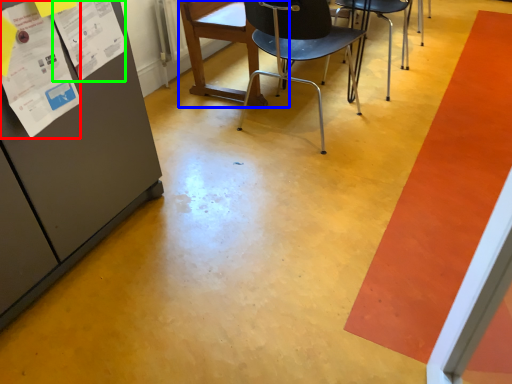
Question: Which is nearer to the poster (highlighted by a red box)? chair (highlighted by a blue box) or poster (highlighted by a green box).

Choices:
 (A) chair
 (B) poster

Answer: (B)